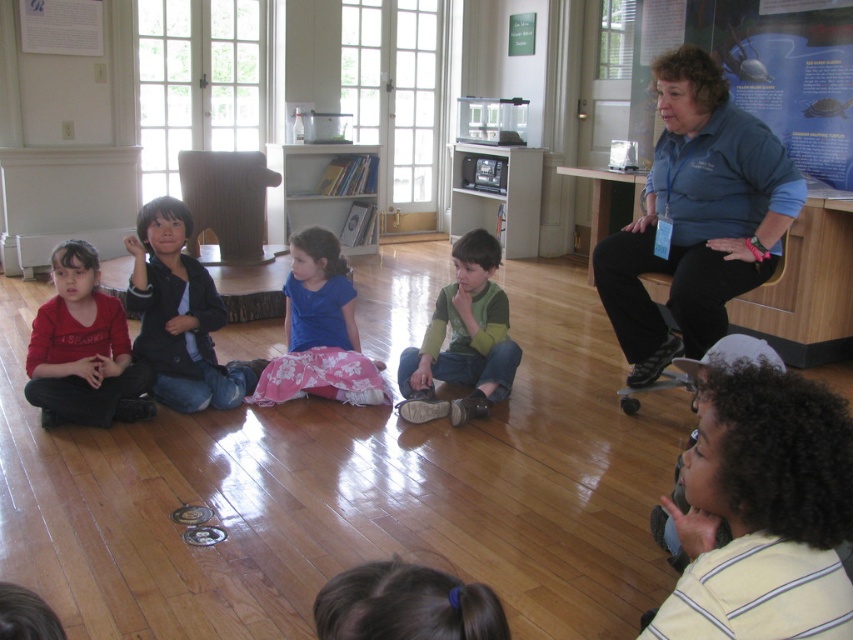
Question: Which point is closer to the camera?

Choices:
 (A) (202, 404)
 (B) (718, 384)
 (C) (497, 337)
 (D) (376, 584)

Answer: (D)

Question: In this image, where is yellow striped shirt at lower right located relative to matte black jacket at left?

Choices:
 (A) right
 (B) left

Answer: (A)

Question: Which is farther from the green suede shoes at center?

Choices:
 (A) matte red shirt at lower left
 (B) blue cotton shirt at upper right
 (C) blue fabric at center

Answer: (A)

Question: Is matte black jacket at left above blue fabric at center?

Choices:
 (A) yes
 (B) no

Answer: (A)

Question: Is blue cotton shirt at upper right wider than matte red shirt at lower left?

Choices:
 (A) yes
 (B) no

Answer: (A)

Question: Which object is the closest to the blue cotton shirt at upper right?

Choices:
 (A) matte black jacket at left
 (B) blue fabric at center
 (C) yellow striped shirt at lower right
 (D) green suede shoes at center

Answer: (D)